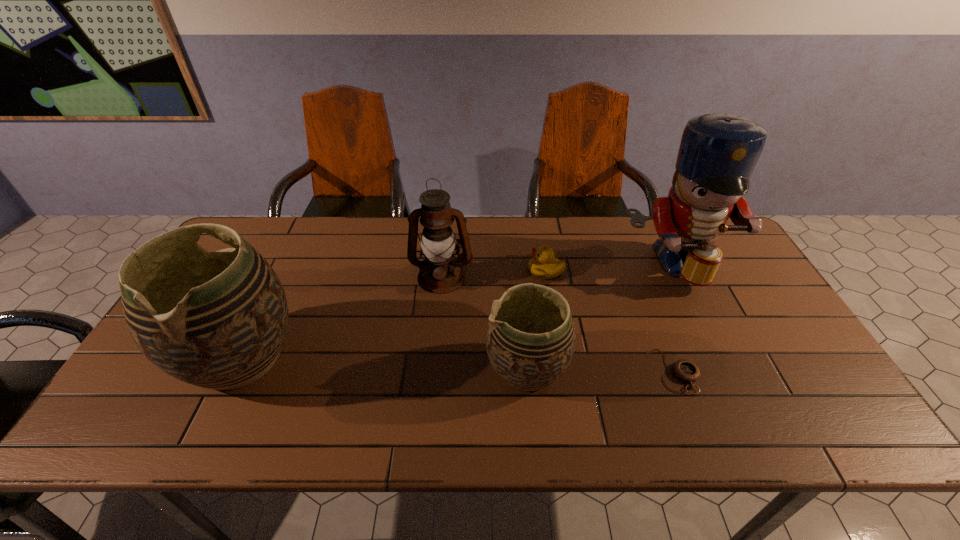
Locate an element on the screen. free area in between the duckling and the tallest object is located at coordinates (609, 267).

Locate an element on the screen. Image resolution: width=960 pixels, height=540 pixels. free space between the taller pottery and the duckling is located at coordinates (394, 314).

Locate an element on the screen. This screenshot has width=960, height=540. unoccupied position between the shortest object and the fourth tallest object is located at coordinates (600, 370).

This screenshot has height=540, width=960. In order to click on vacant point located between the taller pottery and the right pottery in this screenshot , I will do `click(384, 363)`.

Locate an element on the screen. The height and width of the screenshot is (540, 960). empty location between the shorter pottery and the taller pottery is located at coordinates (384, 363).

The height and width of the screenshot is (540, 960). I want to click on free space between the nutcracker and the left pottery, so click(457, 310).

Point out which object is positioned as the second nearest to the second object from left to right. Please provide its 2D coordinates. Your answer should be formatted as a tuple, i.e. [(x, y)], where the tuple contains the x and y coordinates of a point satisfying the conditions above.

[(543, 265)]

You are a GUI agent. You are given a task and a screenshot of the screen. Output one action in this format:
    pyautogui.click(x=<x>, y=<y>)
    Task: Click on the object that stands as the closest to the shortest object
    
    Given the screenshot: What is the action you would take?
    pyautogui.click(x=718, y=152)

At what (x,y) coordinates should I click in order to perform the action: click on free space that satisfies the following two spatial constraints: 1. on the side of the lantern, there is a wick adjustment knob; 2. on the left side of the shorter pottery. Please return your answer as a coordinate pair (x, y). Looking at the image, I should click on (433, 369).

Image resolution: width=960 pixels, height=540 pixels. Find the location of `vacant position in the image that satisfies the following two spatial constraints: 1. on the front side of the leftmost object; 2. on the left side of the shortest object`. vacant position in the image that satisfies the following two spatial constraints: 1. on the front side of the leftmost object; 2. on the left side of the shortest object is located at coordinates (234, 371).